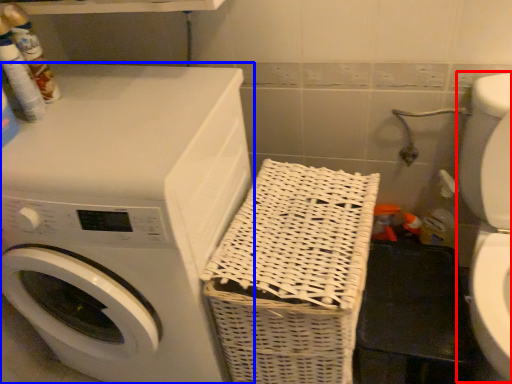
Question: Which object is further to the camera taking this photo, washer (highlighted by a red box) or washing machine (highlighted by a blue box)?

Choices:
 (A) washer
 (B) washing machine

Answer: (B)